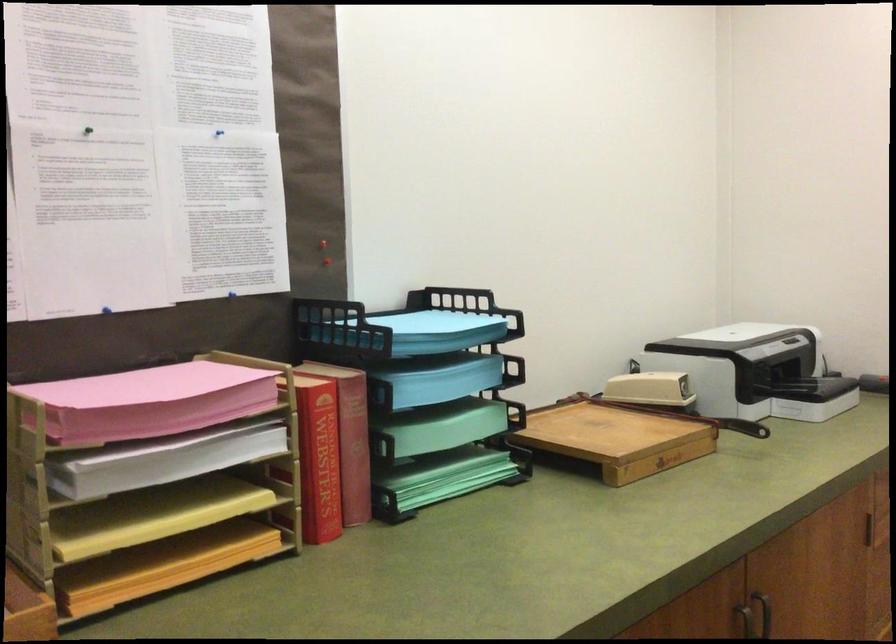
This screenshot has height=644, width=896. What do you see at coordinates (712, 422) in the screenshot?
I see `the black cutter handle` at bounding box center [712, 422].